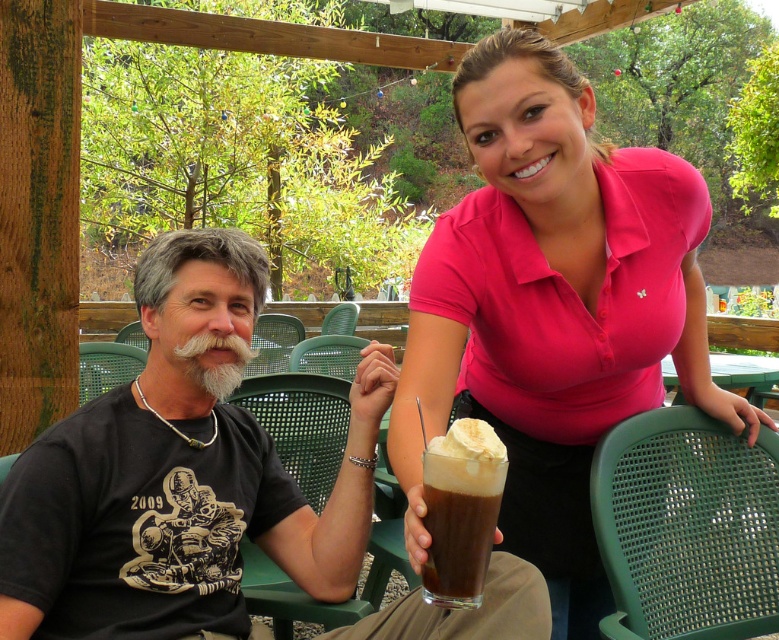
Question: Estimate the real-world distances between objects in this image. Which object is farther from the chocolate frosted glass at center?

Choices:
 (A) black matte t-shirt at left
 (B) pink cotton shirt at upper right

Answer: (B)

Question: Where is pink cotton shirt at upper right located in relation to black matte t-shirt at left in the image?

Choices:
 (A) above
 (B) below

Answer: (A)

Question: Which point is farther to the camera?

Choices:
 (A) (471, 387)
 (B) (206, 572)

Answer: (A)

Question: Which of these objects is positioned farthest from the chocolate frosted glass at center?

Choices:
 (A) black matte t-shirt at left
 (B) pink cotton shirt at upper right

Answer: (B)

Question: Observing the image, what is the correct spatial positioning of pink cotton shirt at upper right in reference to chocolate frosted glass at center?

Choices:
 (A) below
 (B) above

Answer: (B)

Question: Is pink cotton shirt at upper right further to camera compared to chocolate frosted glass at center?

Choices:
 (A) no
 (B) yes

Answer: (B)